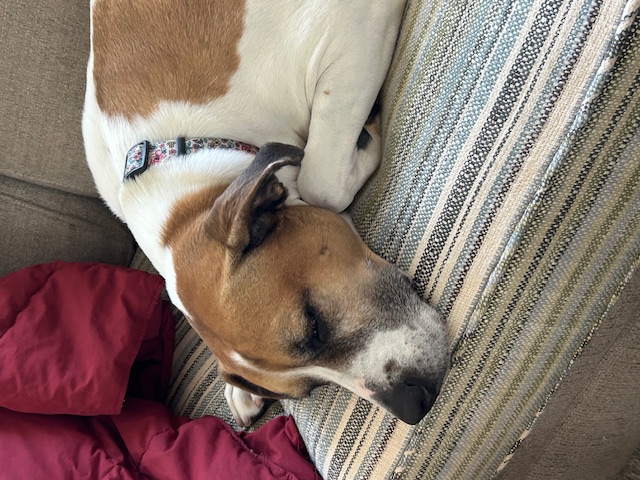
Identify the location of blanket. (180, 72).